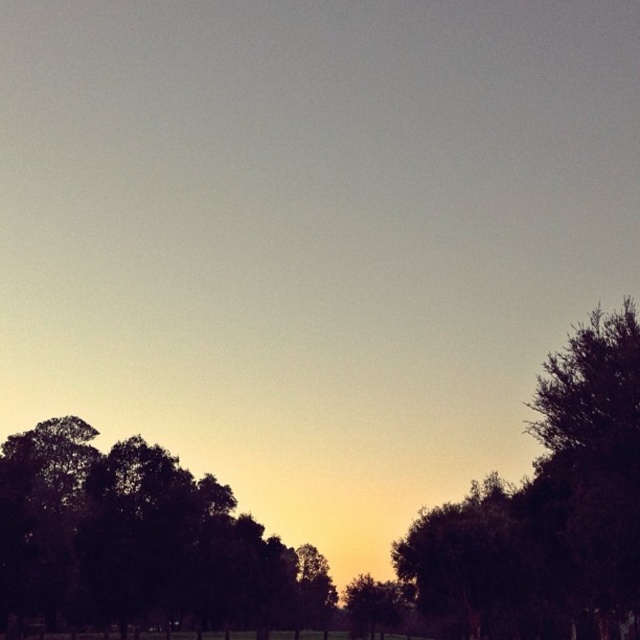
Who is taller, dark green leafy tree at left or green matte tree at center?

green matte tree at center

Can you confirm if dark green leafy tree at left is positioned above green matte tree at center?

Correct, dark green leafy tree at left is located above green matte tree at center.

Is point (209, 627) positioned behind point (358, 612)?

No.

Locate an element on the screen. The width and height of the screenshot is (640, 640). dark green leafy tree at left is located at coordinates (140, 540).

Does dark green leafy tree at right appear over green matte tree at center?

Yes.

How far apart are dark green leafy tree at right and green matte tree at center?

dark green leafy tree at right is 23.63 meters from green matte tree at center.

Where is `dark green leafy tree at right`? dark green leafy tree at right is located at coordinates (548, 508).

Locate an element on the screen. dark green leafy tree at right is located at coordinates (548, 508).

Is point (156, 472) farther from viewer compared to point (506, 561)?

Yes, point (156, 472) is behind point (506, 561).

The width and height of the screenshot is (640, 640). Find the location of `dark green leafy tree at left`. dark green leafy tree at left is located at coordinates (140, 540).

This screenshot has width=640, height=640. What do you see at coordinates (140, 540) in the screenshot?
I see `dark green leafy tree at left` at bounding box center [140, 540].

This screenshot has height=640, width=640. Find the location of `dark green leafy tree at left`. dark green leafy tree at left is located at coordinates (140, 540).